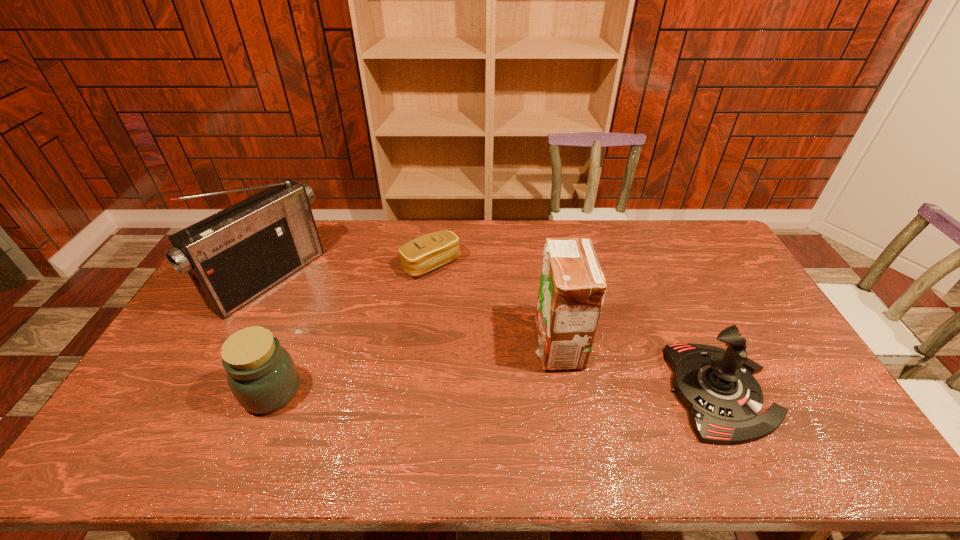
At what (x,y) coordinates should I click in order to perform the action: click on clutch bag located at the far edge. Please return your answer as a coordinate pair (x, y). The width and height of the screenshot is (960, 540). Looking at the image, I should click on (430, 251).

Locate an element on the screen. The width and height of the screenshot is (960, 540). jar positioned at the near edge is located at coordinates (261, 374).

Identify the location of joystick present at the near edge. (716, 385).

Identify the location of object located at the left edge. The image size is (960, 540). (235, 255).

Locate an element on the screen. This screenshot has height=540, width=960. object that is at the right edge is located at coordinates (716, 385).

In order to click on object that is positioned at the far left corner in this screenshot , I will do `click(235, 255)`.

Locate an element on the screen. object that is at the near right corner is located at coordinates (716, 385).

Find the location of a particular element. The width and height of the screenshot is (960, 540). vacant region at the far edge of the desktop is located at coordinates pyautogui.click(x=384, y=220).

The width and height of the screenshot is (960, 540). Find the location of `free space at the near edge`. free space at the near edge is located at coordinates (556, 398).

Where is `vacant space at the left edge of the desktop`? The height and width of the screenshot is (540, 960). vacant space at the left edge of the desktop is located at coordinates (187, 375).